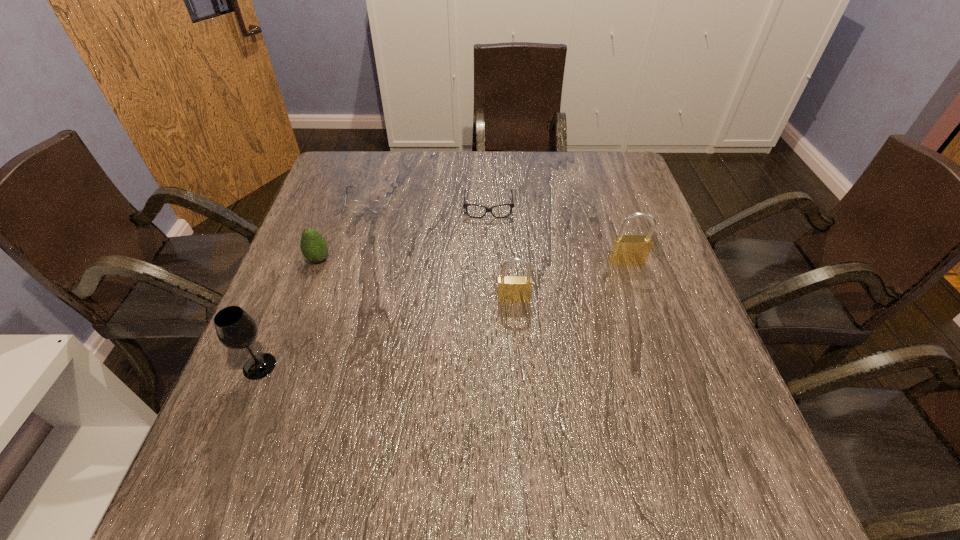
Identify the location of vacant point located between the third shortest object and the left spectacles. This screenshot has height=540, width=960. (345, 230).

Identify the location of free space between the right spectacles and the left spectacles. (430, 204).

Identify the location of vacant space in between the right spectacles and the rightmost object. (558, 235).

The height and width of the screenshot is (540, 960). What are the coordinates of `free area in between the right spectacles and the left spectacles` in the screenshot? It's located at tap(430, 204).

At what (x,y) coordinates should I click in order to perform the action: click on vacant space in between the left spectacles and the farther padlock. Please return your answer as a coordinate pair (x, y). The height and width of the screenshot is (540, 960). Looking at the image, I should click on (499, 231).

Locate an element on the screen. The width and height of the screenshot is (960, 540). free spot between the fourth shortest object and the left spectacles is located at coordinates (443, 249).

Where is `the third closest object relative to the nearest object`? This screenshot has width=960, height=540. the third closest object relative to the nearest object is located at coordinates (513, 289).

Select which object appears as the fourth closest to the right spectacles. Please provide its 2D coordinates. Your answer should be formatted as a tuple, i.e. [(x, y)], where the tuple contains the x and y coordinates of a point satisfying the conditions above.

[(314, 247)]